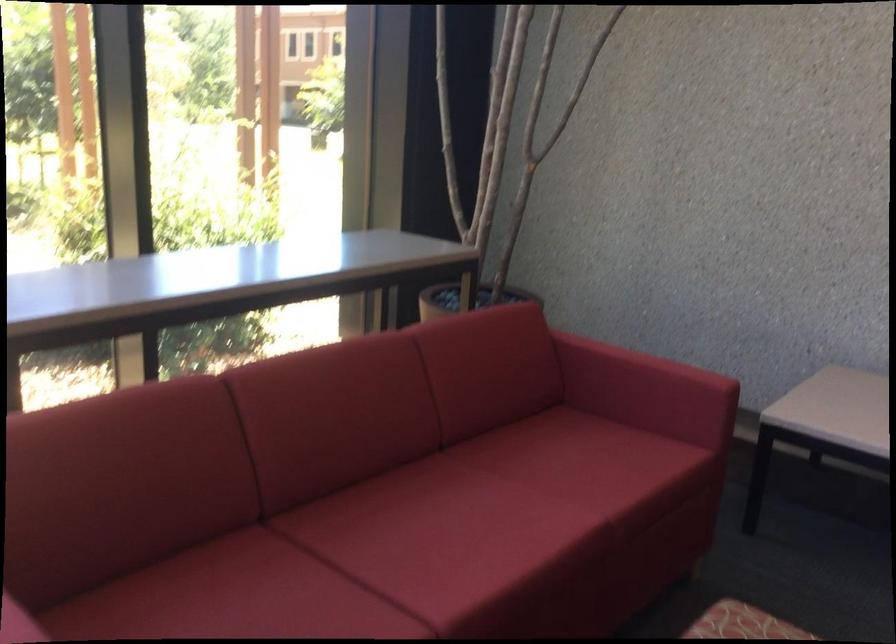
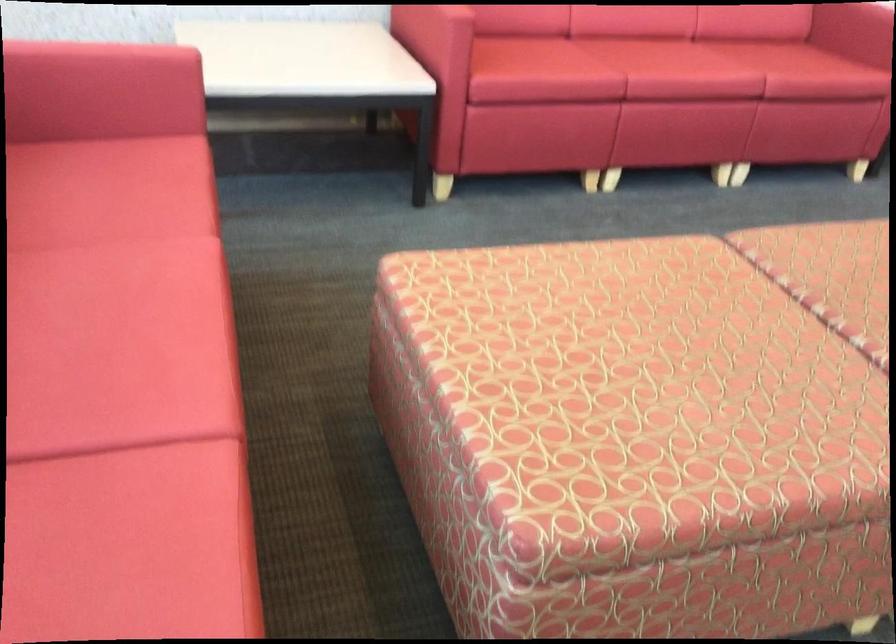
Find the pixel in the second image that matches point (433, 558) in the first image.

(117, 381)